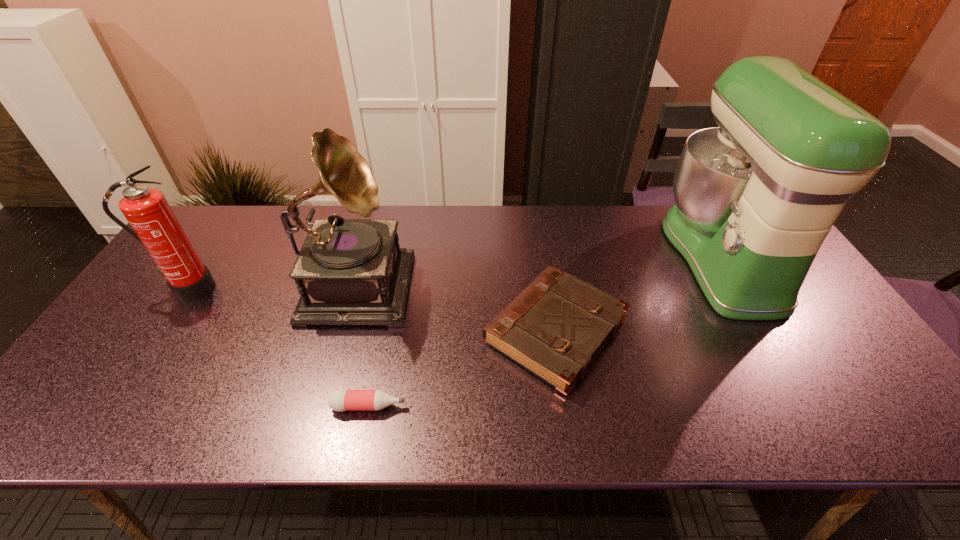
Identify the location of free space that is in between the shortest object and the record player. Image resolution: width=960 pixels, height=540 pixels. (363, 343).

You are a GUI agent. You are given a task and a screenshot of the screen. Output one action in this format:
    pyautogui.click(x=<x>, y=<y>)
    Task: Click on the free space between the shortest object and the fourth object from left to right
    
    Given the screenshot: What is the action you would take?
    pyautogui.click(x=462, y=369)

Where is `free space that is in between the shortest object and the record player`? free space that is in between the shortest object and the record player is located at coordinates (363, 343).

Point out which object is positioned as the fourth nearest to the third tallest object. Please provide its 2D coordinates. Your answer should be formatted as a tuple, i.e. [(x, y)], where the tuple contains the x and y coordinates of a point satisfying the conditions above.

[(755, 198)]

Locate an element on the screen. The width and height of the screenshot is (960, 540). the fourth closest object to the record player is located at coordinates (755, 198).

Where is `free space that satisfies the following two spatial constraints: 1. on the horn of the record player; 2. on the front-facing side of the third tallest object`? This screenshot has width=960, height=540. free space that satisfies the following two spatial constraints: 1. on the horn of the record player; 2. on the front-facing side of the third tallest object is located at coordinates (355, 288).

Identify the location of free spot that satisfies the following two spatial constraints: 1. on the front-facing side of the leftmost object; 2. on the left side of the fourth object from left to right. This screenshot has height=540, width=960. (159, 332).